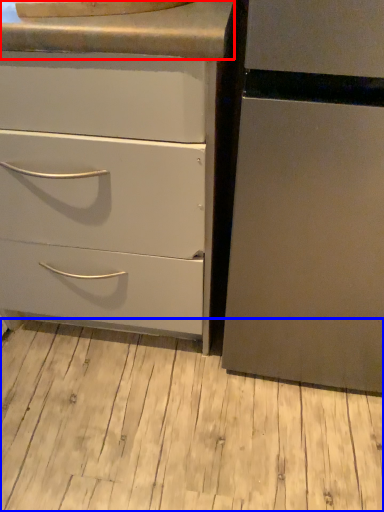
Question: Which point is closer to the camera, counter top (highlighted by a red box) or plank (highlighted by a blue box)?

Choices:
 (A) counter top
 (B) plank

Answer: (A)